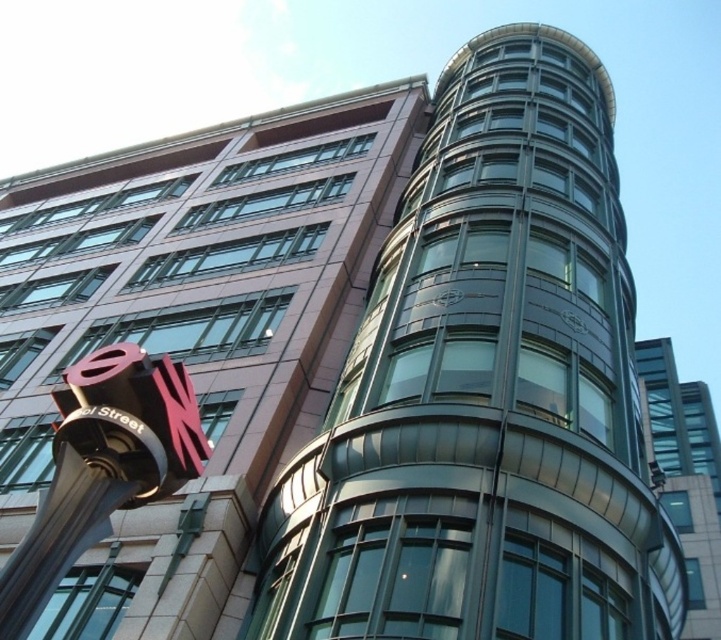
You are standing at the entrance of the modern building and want to locate the brushed metal sign at lower left. According to the coordinates provided, where should you look relative to your position?

The brushed metal sign at lower left is located at coordinates point [102,467], which means it is positioned to the lower left side from your current viewpoint.

You are standing at the entrance of the building and see two points marked on the facade. The first point is at coordinates point (87, 529) and the second is at point (681, 508). Which point is closer to you?

Point (87, 529) is in front of point (681, 508), so it is closer to you.

You are standing in front of a modern building with a red sign. There is a point marked at coordinates point (22,582). Can you estimate how far this point is from your current position?

The point (22,582) is 80.07 feet away from the camera, so it is approximately 80.07 feet away from your current position.